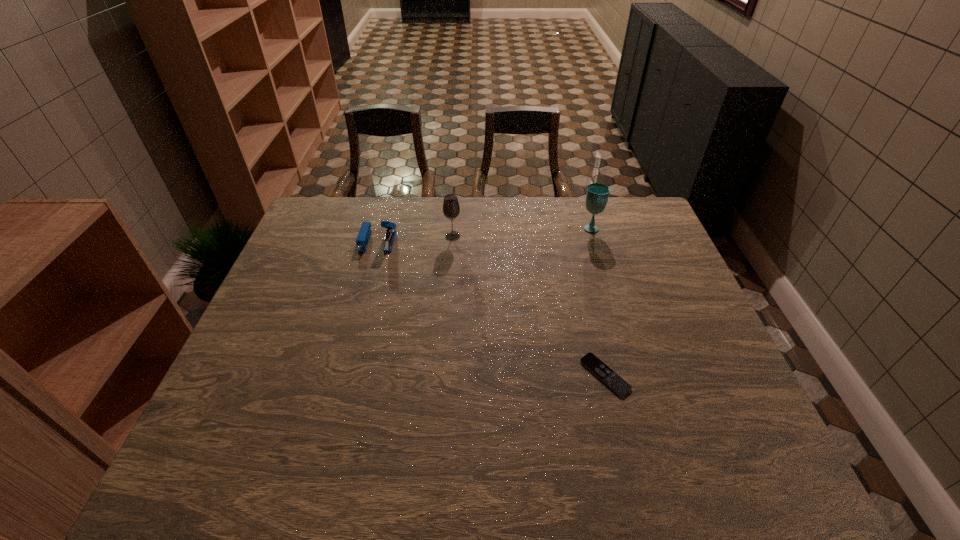
The image size is (960, 540). Find the location of `vacant space that satisfies the following two spatial constraints: 1. on the back side of the right glass drink container; 2. on the left side of the leftmost object`. vacant space that satisfies the following two spatial constraints: 1. on the back side of the right glass drink container; 2. on the left side of the leftmost object is located at coordinates (381, 227).

The image size is (960, 540). Identify the location of free location that satisfies the following two spatial constraints: 1. on the back side of the right glass drink container; 2. on the left side of the stapler. (381, 227).